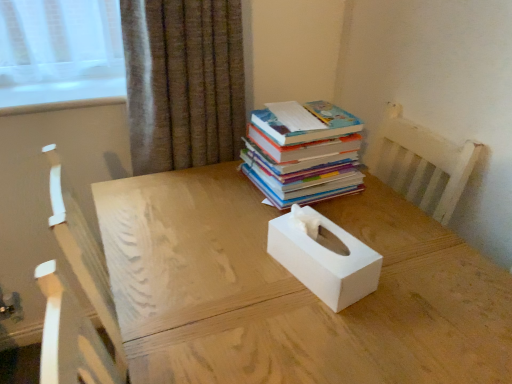
Image resolution: width=512 pixels, height=384 pixels. I want to click on vacant space to the left of white matte tissue box at center, so click(233, 267).